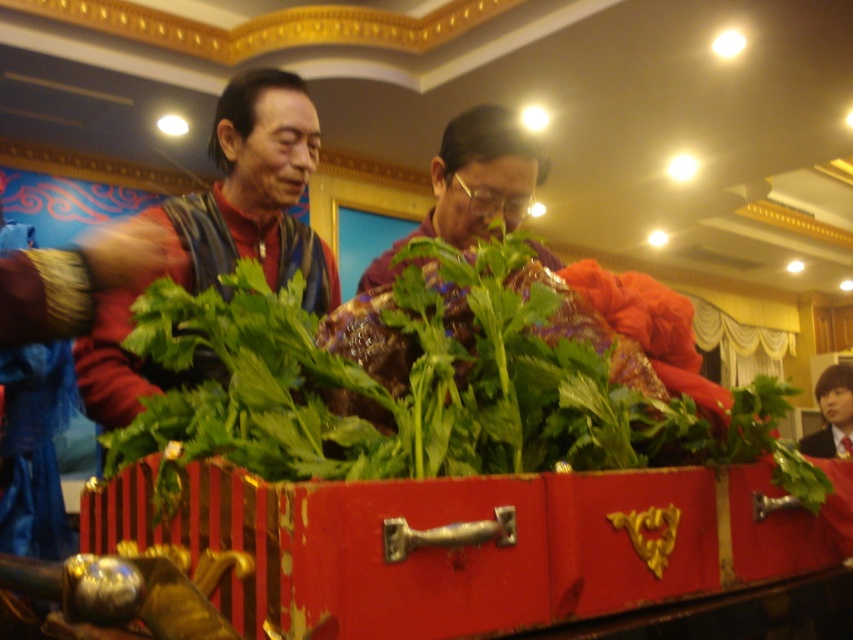
Question: Is green leafy vegetable at center to the right of matte black vest at left from the viewer's perspective?

Choices:
 (A) yes
 (B) no

Answer: (A)

Question: From the image, what is the correct spatial relationship of green leafy vegetable at center in relation to matte black vest at left?

Choices:
 (A) above
 (B) below

Answer: (B)

Question: Which of the following is the farthest from the observer?

Choices:
 (A) matte black vest at left
 (B) green leafy vegetable at center

Answer: (B)

Question: In this image, where is green leafy vegetable at center located relative to matte black vest at left?

Choices:
 (A) left
 (B) right

Answer: (B)